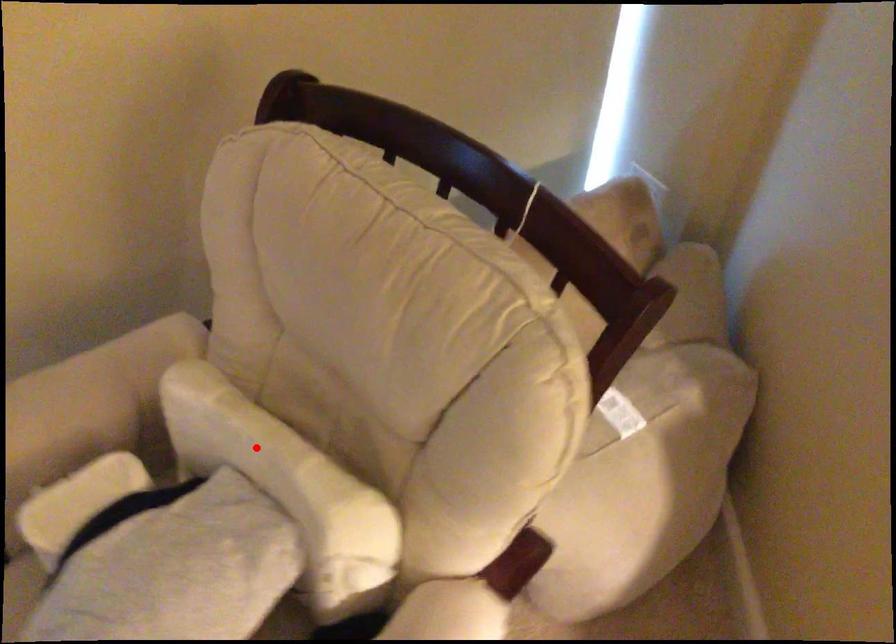
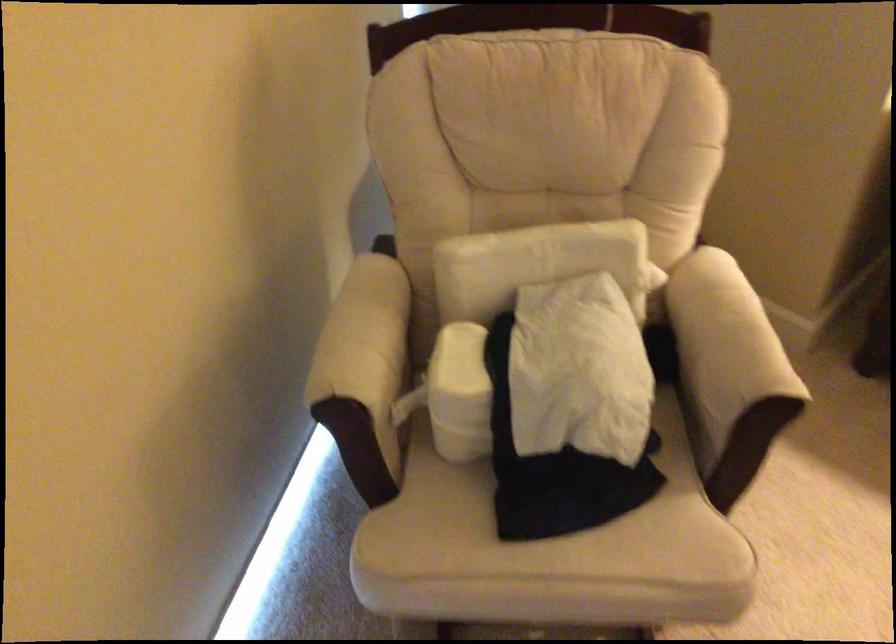
Question: I am providing you with two images of the same scene from different viewpoints. Image1 has a red point marked. In image2, the corresponding 3D location appears at what relative position? Reply with the corresponding letter.

Choices:
 (A) Closer
 (B) Farther

Answer: (B)